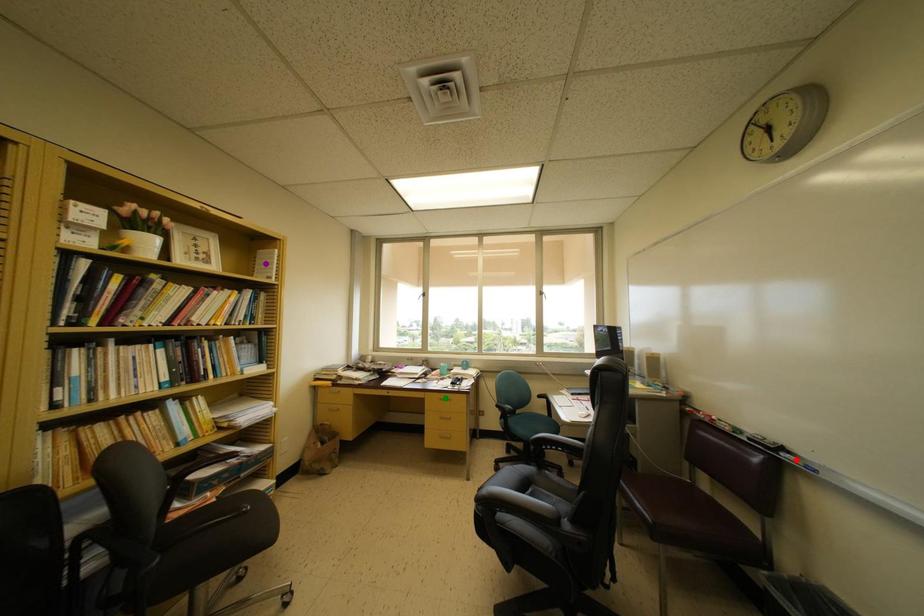
Order these from farthest to nearest:
red point | green point | purple point

green point
purple point
red point